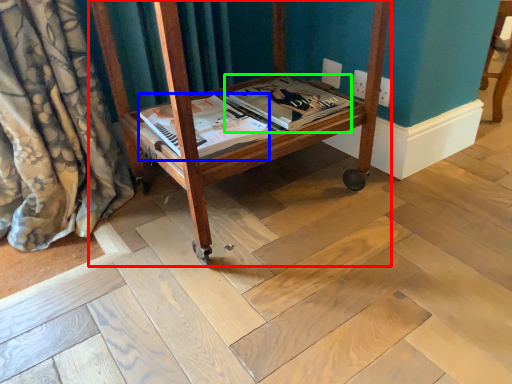
Question: Which object is positioned closest to furniture (highlighted by a red box)? Select from magazine (highlighted by a blue box) and magazine (highlighted by a green box).

Choices:
 (A) magazine
 (B) magazine

Answer: (A)